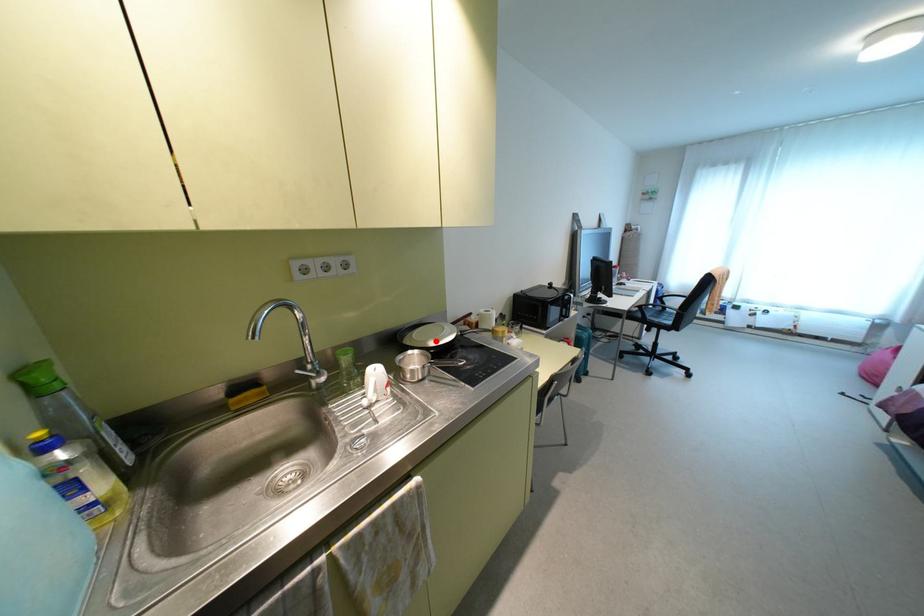
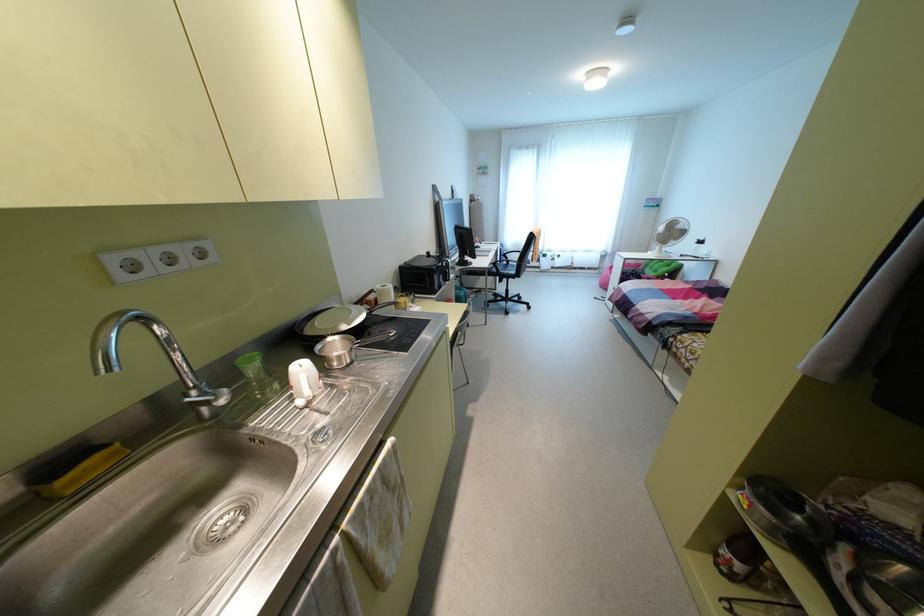
The point at the highlighted location is marked in the first image. Where is the corresponding point in the second image?

(348, 323)